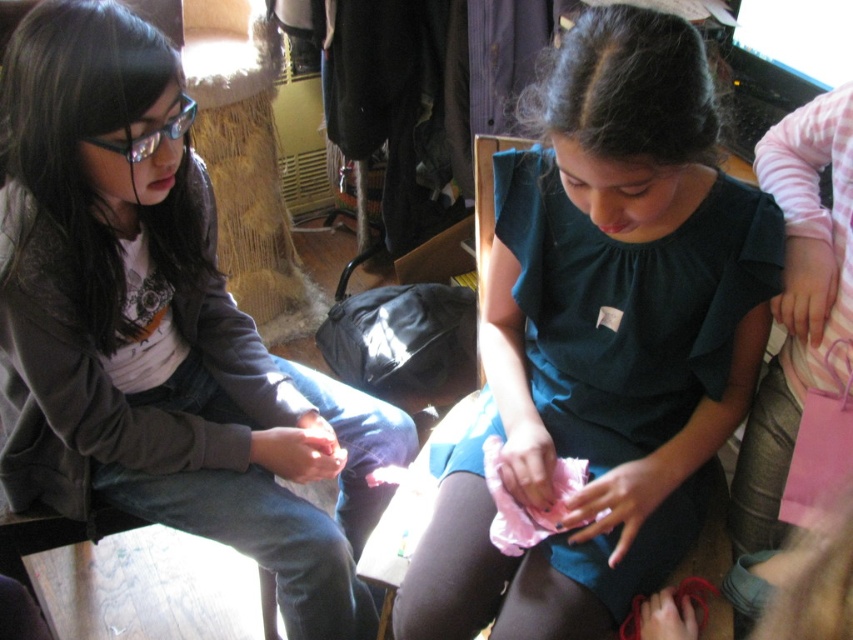
Question: Which of the following is the closest to the observer?

Choices:
 (A) click(691, 218)
 (B) click(297, 625)

Answer: (A)

Question: Which object appears closest to the camera in this image?

Choices:
 (A) dark green fabric dress at center
 (B) matte black jacket at left

Answer: (A)

Question: Which of the following is the closest to the observer?

Choices:
 (A) (297, 388)
 (B) (584, 564)

Answer: (B)

Question: Can you confirm if dark green fabric dress at center is positioned to the left of matte black jacket at left?

Choices:
 (A) yes
 (B) no

Answer: (B)

Question: Does dark green fabric dress at center have a smaller size compared to matte black jacket at left?

Choices:
 (A) yes
 (B) no

Answer: (A)

Question: Does dark green fabric dress at center appear on the left side of matte black jacket at left?

Choices:
 (A) yes
 (B) no

Answer: (B)